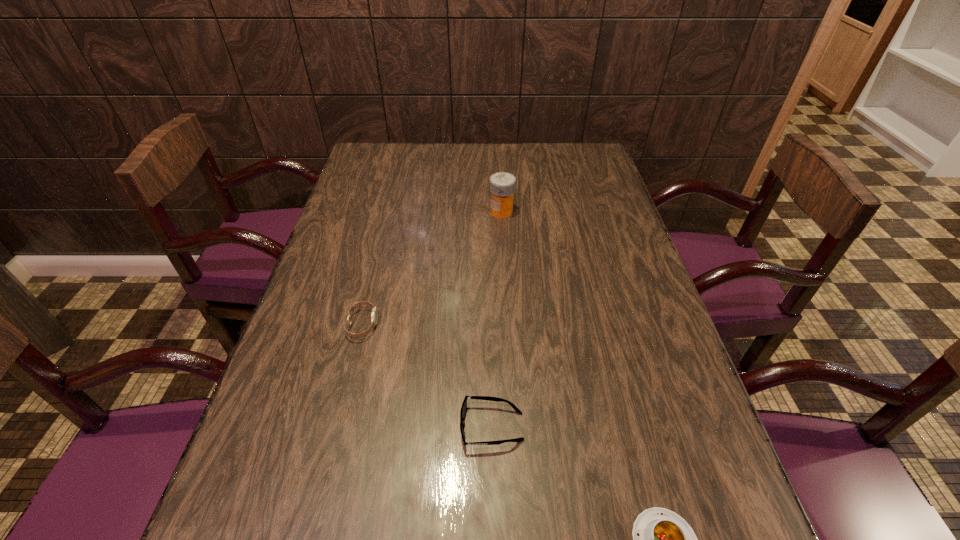
Identify the location of the farthest object. (502, 184).

Identify the location of medicine. point(502,184).

This screenshot has height=540, width=960. I want to click on the third nearest object, so click(374, 315).

The width and height of the screenshot is (960, 540). Find the location of `watch`. watch is located at coordinates (374, 315).

Identify the location of sunglasses. (463, 411).

Locate an element on the screen. the third farthest object is located at coordinates (463, 411).

Find the location of a particular element. free spot located 0.380m on the label side of the medicine is located at coordinates click(x=364, y=212).

I want to click on free location located 0.340m on the label side of the medicine, so tap(377, 212).

This screenshot has height=540, width=960. I want to click on vacant region located on the label side of the medicine, so click(x=460, y=212).

The height and width of the screenshot is (540, 960). I want to click on vacant space located on the face of the watch, so [x=450, y=325].